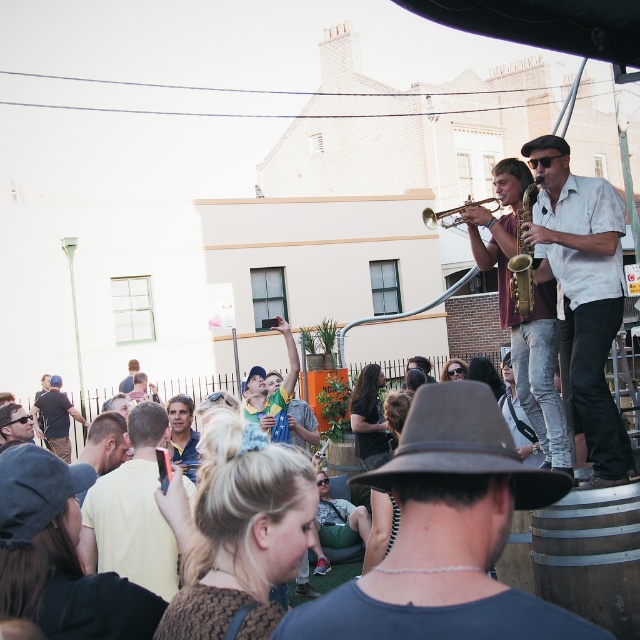
Question: Which object appears closest to the camera in this image?

Choices:
 (A) wooden barrel at lower right
 (B) gold metallic trumpet at upper center
 (C) brown felt fedora at center

Answer: (C)

Question: Which of the following is the farthest from the observer?

Choices:
 (A) brown felt fedora at center
 (B) matte blue shirt at center
 (C) brown leather hat at center

Answer: (B)

Question: Is brown felt fedora at center below yellow-green shirt at center?

Choices:
 (A) yes
 (B) no

Answer: (B)

Question: Which object is farther from the camera taking this photo?

Choices:
 (A) gold metallic trumpet at upper center
 (B) gold brass trumpet at center
 (C) yellow-green shirt at center

Answer: (C)

Question: Can you confirm if wooden barrel at lower right is smaller than gold brass trumpet at center?

Choices:
 (A) no
 (B) yes

Answer: (A)

Question: Does dark brown leather hat at center have a lesser width compared to brown leather hat at center?

Choices:
 (A) no
 (B) yes

Answer: (A)